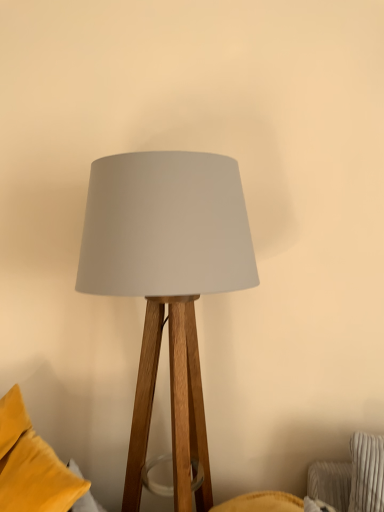
Question: Does matte wood lamp at center come in front of velvet yellow pillow at lower left?

Choices:
 (A) yes
 (B) no

Answer: (B)

Question: Is matte wood lamp at center bigger than velvet yellow pillow at lower left?

Choices:
 (A) yes
 (B) no

Answer: (A)

Question: Could you tell me if matte wood lamp at center is facing velvet yellow pillow at lower left?

Choices:
 (A) no
 (B) yes

Answer: (A)

Question: Is matte wood lamp at center further to camera compared to velvet yellow pillow at lower left?

Choices:
 (A) no
 (B) yes

Answer: (B)

Question: Is the surface of matte wood lamp at center in direct contact with velvet yellow pillow at lower left?

Choices:
 (A) no
 (B) yes

Answer: (A)

Question: Considering the relative sizes of matte wood lamp at center and velvet yellow pillow at lower left in the image provided, is matte wood lamp at center shorter than velvet yellow pillow at lower left?

Choices:
 (A) no
 (B) yes

Answer: (A)

Question: From the image's perspective, would you say velvet yellow pillow at lower left is positioned over matte wood lamp at center?

Choices:
 (A) yes
 (B) no

Answer: (B)

Question: Is velvet yellow pillow at lower left at the left side of matte wood lamp at center?

Choices:
 (A) yes
 (B) no

Answer: (A)

Question: Is velvet yellow pillow at lower left looking in the opposite direction of matte wood lamp at center?

Choices:
 (A) yes
 (B) no

Answer: (B)

Question: From the image's perspective, does velvet yellow pillow at lower left appear lower than matte wood lamp at center?

Choices:
 (A) no
 (B) yes

Answer: (B)

Question: Can you confirm if velvet yellow pillow at lower left is positioned to the right of matte wood lamp at center?

Choices:
 (A) no
 (B) yes

Answer: (A)

Question: Does velvet yellow pillow at lower left have a greater width compared to matte wood lamp at center?

Choices:
 (A) no
 (B) yes

Answer: (A)

Question: From the image's perspective, is velvet yellow pillow at lower left positioned above or below matte wood lamp at center?

Choices:
 (A) above
 (B) below

Answer: (B)